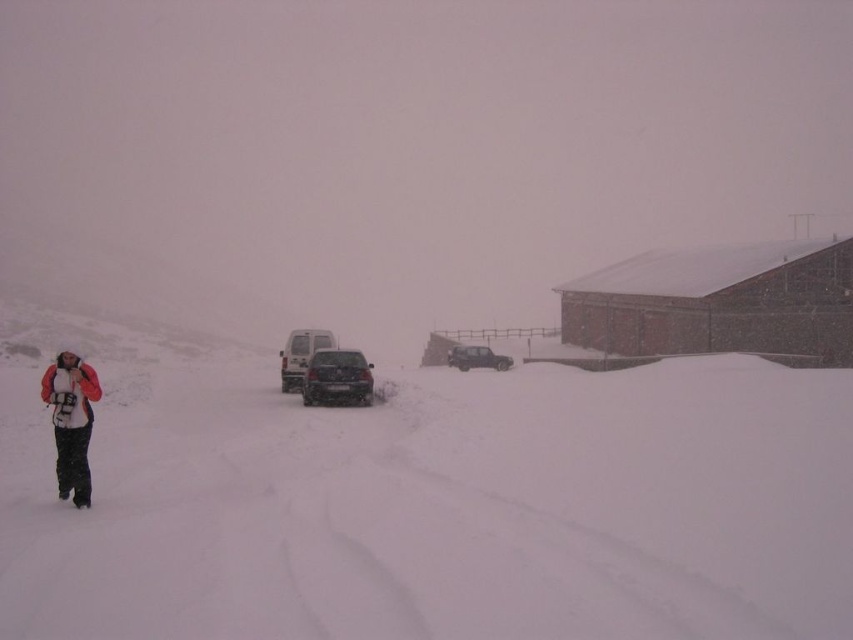
You are standing at the edge of the snowy road and want to walk to the brick red building at right. Which direction should you head relative to the dark gray matte suv at center?

The brick red building at right is above the dark gray matte suv at center, so you should head towards the direction above the dark gray matte suv at center to reach the brick red building at right.

You are a delivery driver who needs to park your dark gray matte suv at center near the brick red building at right. Based on the scene, can you safely park your suv next to the building without hitting it?

The brick red building at right is taller than the dark gray matte suv at center. Since the building is taller, it is likely that the suv can park safely next to it without hitting the building.

You are a photographer standing in the snowy landscape. You want to take a photo of the orange fleece jacket at left and the satin black suv at center. Which object should you focus on first if you want to capture both in sharp focus without moving the camera?

You should focus on the orange fleece jacket at left first because it is closer to the viewer than the satin black suv at center. By focusing on the closer object, the farther object will still be within the depth of field and appear sharp.